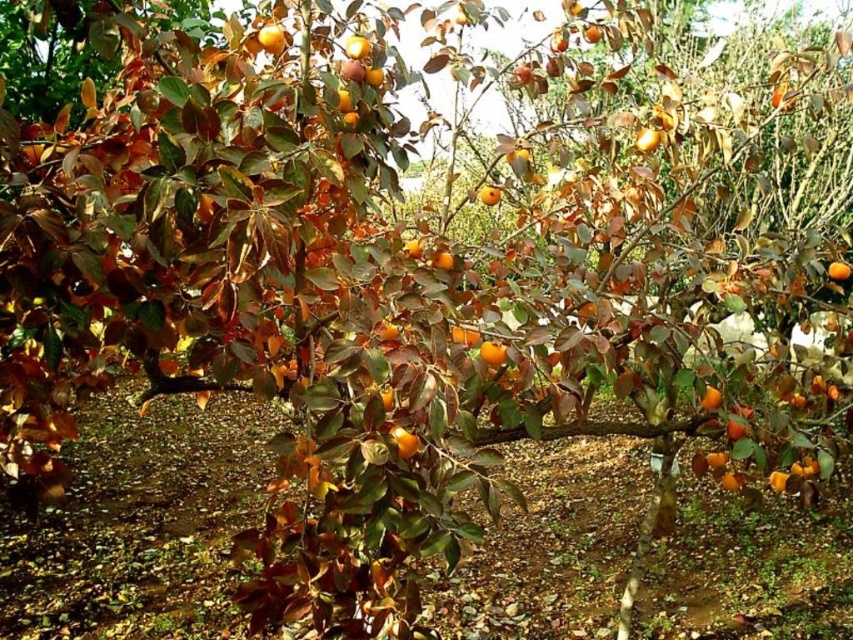
You are standing in an autumn scene with a persimmon tree. You notice a point marked at coordinates (x=711, y=397). What color is the material at that point?

The material at point (x=711, y=397) is orange matte.